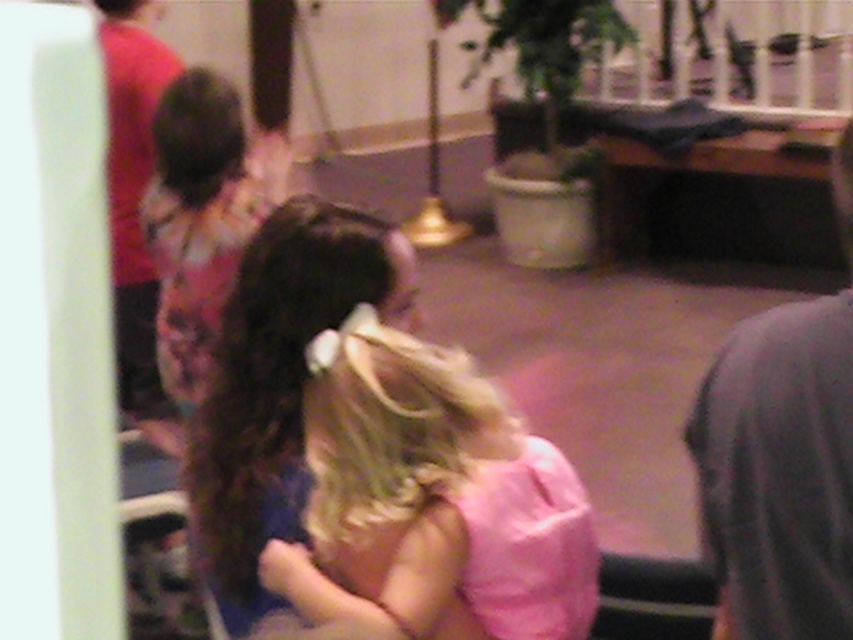
Question: Does dark brown silky hair at center have a greater width compared to blonde silky hair at lower right?

Choices:
 (A) yes
 (B) no

Answer: (A)

Question: Does dark brown silky hair at center have a lesser width compared to red shirt at left?

Choices:
 (A) yes
 (B) no

Answer: (B)

Question: Estimate the real-world distances between objects in this image. Which object is farther from the blonde silky hair at lower right?

Choices:
 (A) red shirt at left
 (B) pink fabric at center
 (C) gray fabric shirt at right
 (D) fluffy pink dress at upper left

Answer: (C)

Question: Which point appears farthest from the camera in this image?

Choices:
 (A) (102, 0)
 (B) (178, 131)
 (C) (755, 451)
 (D) (207, 164)

Answer: (A)

Question: Is red shirt at left closer to the viewer compared to dark brown silky hair at upper left?

Choices:
 (A) yes
 (B) no

Answer: (A)

Question: Which of the following is the closest to the observer?

Choices:
 (A) (128, 8)
 (B) (138, 60)
 (C) (543, 474)

Answer: (C)